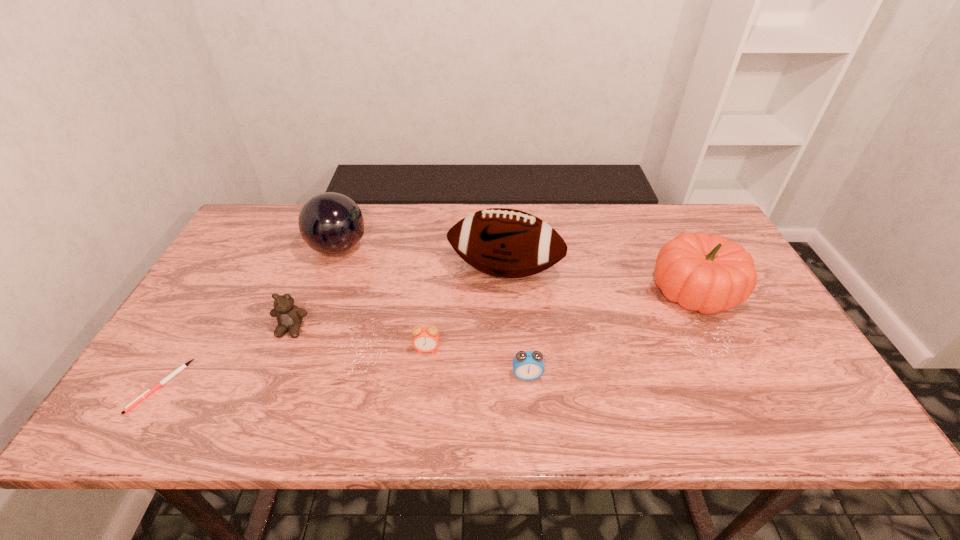
At what (x,y) coordinates should I click in order to perform the action: click on object present at the right edge. Please return your answer as a coordinate pair (x, y). The height and width of the screenshot is (540, 960). Looking at the image, I should click on tap(706, 273).

The height and width of the screenshot is (540, 960). What are the coordinates of `object that is positioned at the near left corner` in the screenshot? It's located at (149, 391).

I want to click on vacant space at the far edge of the desktop, so [572, 245].

In the image, there is a desktop. Where is `blank space at the near edge`? The image size is (960, 540). blank space at the near edge is located at coordinates (730, 425).

Identify the location of free space at the left edge of the desktop. The image size is (960, 540). (193, 323).

Locate an element on the screen. This screenshot has height=540, width=960. vacant space at the right edge of the desktop is located at coordinates (781, 379).

Locate an element on the screen. This screenshot has width=960, height=540. vacant region at the near left corner of the desktop is located at coordinates (191, 417).

Where is `free spot at the far right corner of the desktop`? free spot at the far right corner of the desktop is located at coordinates (714, 229).

Find the location of `free space between the fourth object from left to right and the leftmost object`. free space between the fourth object from left to right and the leftmost object is located at coordinates coord(294,368).

Where is `vacant space in between the teddy bear and the leftmost object`? vacant space in between the teddy bear and the leftmost object is located at coordinates (226, 357).